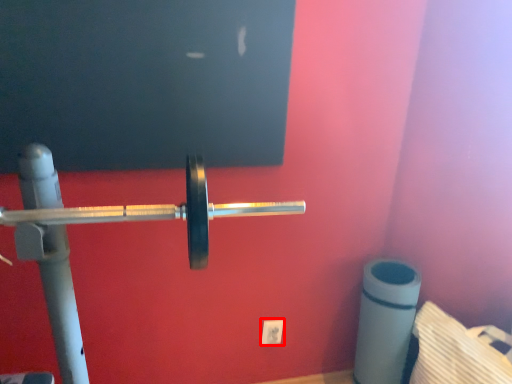
Question: From the image's perspective, considering the relative positions of power plugs and sockets (annotated by the red box) and barbell in the image provided, where is power plugs and sockets (annotated by the red box) located with respect to the staircase?

Choices:
 (A) above
 (B) below

Answer: (B)